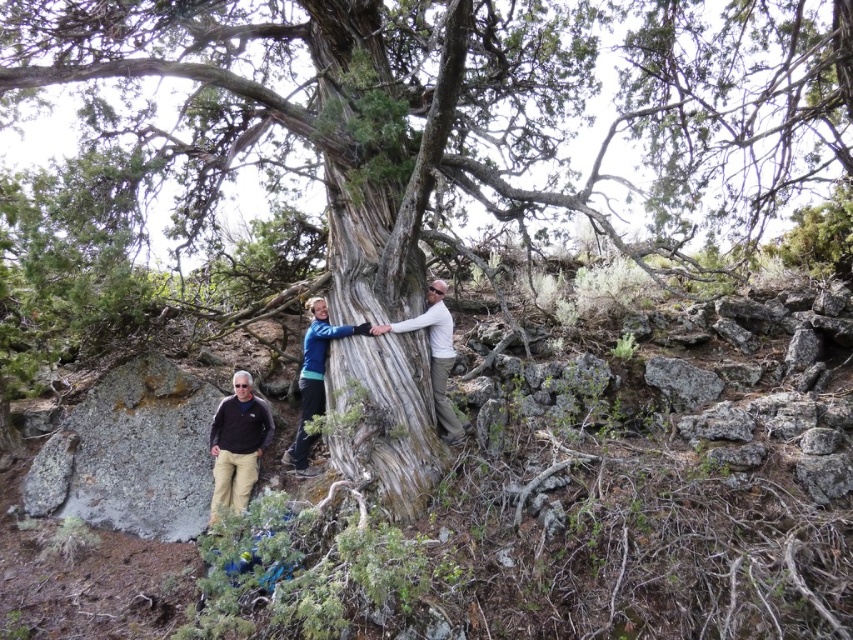
You are a photographer trying to capture the gray textured tree trunk at center in your shot. If your camera frame has a center point at coordinates 0.5, 0.5, will the trunk be centered in your photo?

The gray textured tree trunk at center is located at coordinates (376, 156), which is to the left and slightly below the camera frame center at (426, 320). Therefore, the trunk will not be centered in the photo.

You are planning to wrap a measuring tape around the gray textured tree trunk at center and the smooth gray bark at center to determine their widths. Based on the scene, which one do you think will have a greater measurement?

The gray textured tree trunk at center has a greater width than the smooth gray bark at center, so the measurement around the gray textured tree trunk at center will be larger.

You are a hiker who wants to hang a lightweight backpack on the tree. The blue fabric jacket at center is already hanging below the smooth gray bark at center. Where should you hang your backpack to avoid it touching the ground?

You should hang your backpack above the blue fabric jacket at center since it is located below the smooth gray bark at center, ensuring it stays off the ground.